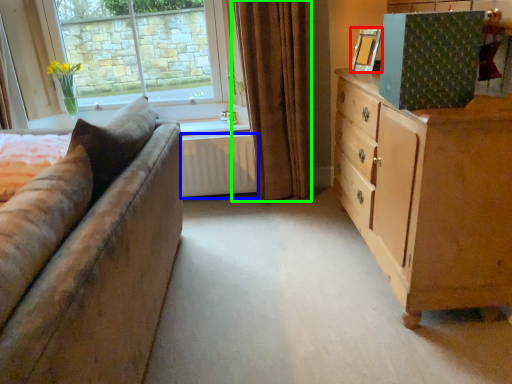
Question: Which is nearer to the picture frame (highlighted by a red box)? radiator (highlighted by a blue box) or curtain (highlighted by a green box).

Choices:
 (A) radiator
 (B) curtain

Answer: (B)